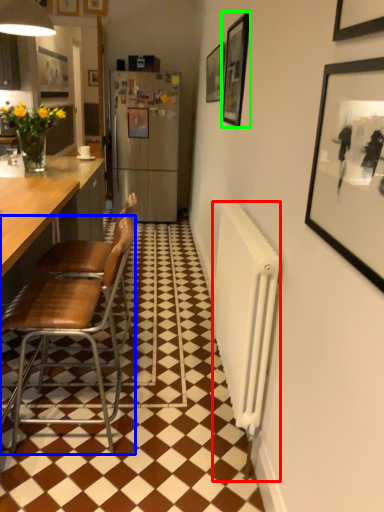
Question: Which object is positioned closest to radiator (highlighted by a red box)? Select from chair (highlighted by a blue box) and picture frame (highlighted by a green box).

Choices:
 (A) chair
 (B) picture frame

Answer: (A)